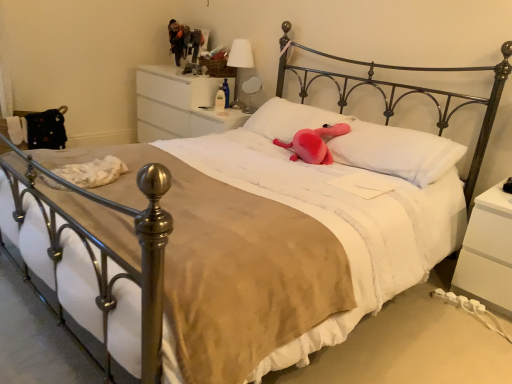
How much space does white soft pillow at center, placed as the 2th pillow when sorted from right to left, occupy horizontally?

white soft pillow at center, placed as the 2th pillow when sorted from right to left, is 14.45 inches in width.

The width and height of the screenshot is (512, 384). What are the coordinates of `white fabric-covered table lamp at upper center, acting as the 1th table lamp starting from the top` in the screenshot? It's located at (239, 65).

This screenshot has width=512, height=384. I want to click on pink plush toy at center, so click(x=314, y=143).

How different are the orientations of white glossy table lamp at upper center, which is counted as the first table lamp, starting from the bottom, and white fabric-covered table lamp at upper center, acting as the 1th table lamp starting from the top, in degrees?

→ The angular difference between white glossy table lamp at upper center, which is counted as the first table lamp, starting from the bottom, and white fabric-covered table lamp at upper center, acting as the 1th table lamp starting from the top, is 2.11 degrees.

In the scene shown: Measure the distance from white glossy table lamp at upper center, which appears as the second table lamp when viewed from the top, to white fabric-covered table lamp at upper center, the 2th table lamp when ordered from bottom to top.

white glossy table lamp at upper center, which appears as the second table lamp when viewed from the top, and white fabric-covered table lamp at upper center, the 2th table lamp when ordered from bottom to top, are 6.90 inches apart.

Is white glossy table lamp at upper center, which is counted as the first table lamp, starting from the bottom, not within white fabric-covered table lamp at upper center, the 2th table lamp when ordered from bottom to top?

Yes, white glossy table lamp at upper center, which is counted as the first table lamp, starting from the bottom, is located beyond the bounds of white fabric-covered table lamp at upper center, the 2th table lamp when ordered from bottom to top.

Considering the positions of objects white glossy table lamp at upper center, which appears as the second table lamp when viewed from the top, and white fabric-covered table lamp at upper center, the 2th table lamp when ordered from bottom to top, in the image provided, who is behind, white glossy table lamp at upper center, which appears as the second table lamp when viewed from the top, or white fabric-covered table lamp at upper center, the 2th table lamp when ordered from bottom to top,?

white glossy table lamp at upper center, which appears as the second table lamp when viewed from the top, is further away from the camera.

From the image's perspective, is white glossy table lamp at upper center, which appears as the second table lamp when viewed from the top, located above or below pink plush toy at center?

white glossy table lamp at upper center, which appears as the second table lamp when viewed from the top, is situated higher than pink plush toy at center in the image.

Can you tell me how much white glossy table lamp at upper center, which is counted as the first table lamp, starting from the bottom, and pink plush toy at center differ in facing direction?

Answer: The angle between the facing direction of white glossy table lamp at upper center, which is counted as the first table lamp, starting from the bottom, and the facing direction of pink plush toy at center is 7.15 degrees.

Is white glossy table lamp at upper center, which appears as the second table lamp when viewed from the top, oriented towards pink plush toy at center?

No, white glossy table lamp at upper center, which appears as the second table lamp when viewed from the top, is not facing towards pink plush toy at center.

From their relative heights in the image, would you say white glossy table lamp at upper center, which is counted as the first table lamp, starting from the bottom, is taller or shorter than pink plush toy at center?

Considering their sizes, white glossy table lamp at upper center, which is counted as the first table lamp, starting from the bottom, has more height than pink plush toy at center.

From the image's perspective, which is above, white soft pillow at center, placed as the 2th pillow when sorted from right to left, or white glossy nightstand at upper center, which ranks as the second nightstand in back-to-front order?

white glossy nightstand at upper center, which ranks as the second nightstand in back-to-front order, appears higher in the image.

Does white soft pillow at center, the 1th pillow viewed from the left, have a larger size compared to white glossy nightstand at upper center, the 2th nightstand from the bottom?

Yes.

From the picture: From a real-world perspective, is white soft pillow at center, placed as the 2th pillow when sorted from right to left, physically located above or below white glossy nightstand at upper center, the second nightstand from the top?

In terms of real-world spatial position, white soft pillow at center, placed as the 2th pillow when sorted from right to left, is above white glossy nightstand at upper center, the second nightstand from the top.

Is white soft pillow at center, the 1th pillow viewed from the left, next to white glossy nightstand at upper center, acting as the 2th nightstand starting from the left?

No, white soft pillow at center, the 1th pillow viewed from the left, is not with white glossy nightstand at upper center, acting as the 2th nightstand starting from the left.

From a real-world perspective, does pink plush toy at center stand above white glossy nightstand at upper center, acting as the 2th nightstand starting from the left?

Yes, from a real-world perspective, pink plush toy at center is above white glossy nightstand at upper center, acting as the 2th nightstand starting from the left.

Which is closer, (319,145) or (240,124)?

Positioned in front is point (319,145).

Is white glossy nightstand at upper center, the second nightstand from the top, a part of pink plush toy at center?

No, pink plush toy at center does not contain white glossy nightstand at upper center, the second nightstand from the top.

Between pink plush toy at center and white glossy nightstand at upper center, the 2th nightstand from the bottom, which one appears on the left side from the viewer's perspective?

From the viewer's perspective, white glossy nightstand at upper center, the 2th nightstand from the bottom, appears more on the left side.

From the image's perspective, is white fabric-covered table lamp at upper center, the 2th table lamp when ordered from bottom to top, located beneath white soft pillow at center, placed as the 2th pillow when sorted from right to left?

No.

Looking at their sizes, would you say white fabric-covered table lamp at upper center, acting as the 1th table lamp starting from the top, is wider or thinner than white soft pillow at center, the 1th pillow viewed from the left?

white fabric-covered table lamp at upper center, acting as the 1th table lamp starting from the top, is thinner than white soft pillow at center, the 1th pillow viewed from the left.

Is white fabric-covered table lamp at upper center, the 2th table lamp when ordered from bottom to top, smaller than white soft pillow at center, placed as the 2th pillow when sorted from right to left?

Yes.

Based on the photo, between white fabric-covered table lamp at upper center, acting as the 1th table lamp starting from the top, and white soft pillow at center, placed as the 2th pillow when sorted from right to left, which one has more height?

With more height is white fabric-covered table lamp at upper center, acting as the 1th table lamp starting from the top.

Which of these two, white soft pillow at center, the 1th pillow viewed from the left, or pink plush toy at center, is bigger?

Bigger between the two is white soft pillow at center, the 1th pillow viewed from the left.

Is point (251, 123) farther from viewer compared to point (345, 128)?

Yes, it is.

Looking at this image, is white soft pillow at center, the 1th pillow viewed from the left, next to pink plush toy at center and touching it?

No, white soft pillow at center, the 1th pillow viewed from the left, is not beside pink plush toy at center.

Can you confirm if white fluffy blanket at lower left is positioned to the right of white soft pillow at center, placed as the 2th pillow when sorted from right to left?

In fact, white fluffy blanket at lower left is to the left of white soft pillow at center, placed as the 2th pillow when sorted from right to left.

How many degrees apart are the facing directions of white fluffy blanket at lower left and white soft pillow at center, placed as the 2th pillow when sorted from right to left?

white fluffy blanket at lower left and white soft pillow at center, placed as the 2th pillow when sorted from right to left, are facing 10.3 degrees away from each other.

Would you say white fluffy blanket at lower left is outside white soft pillow at center, the 1th pillow viewed from the left?

white fluffy blanket at lower left is positioned outside white soft pillow at center, the 1th pillow viewed from the left.

From a real-world perspective, is white fluffy blanket at lower left physically above white soft pillow at center, placed as the 2th pillow when sorted from right to left?

Actually, white fluffy blanket at lower left is physically below white soft pillow at center, placed as the 2th pillow when sorted from right to left, in the real world.

Where is `table lamp below the white fabric-covered table lamp at upper center, the 2th table lamp when ordered from bottom to top (from the image's perspective)`? The height and width of the screenshot is (384, 512). table lamp below the white fabric-covered table lamp at upper center, the 2th table lamp when ordered from bottom to top (from the image's perspective) is located at coordinates (251, 91).

The image size is (512, 384). What are the coordinates of `the 1st table lamp counting from the left of the pink plush toy at center` in the screenshot? It's located at (251, 91).

When comparing their distances from white fabric-covered table lamp at upper center, acting as the 1th table lamp starting from the top, does white glossy table lamp at upper center, which appears as the second table lamp when viewed from the top, or white fluffy blanket at lower left seem closer?

Among the two, white glossy table lamp at upper center, which appears as the second table lamp when viewed from the top, is located nearer to white fabric-covered table lamp at upper center, acting as the 1th table lamp starting from the top.

Estimate the real-world distances between objects in this image. Which object is closer to white glossy drawer at upper center, which appears as the 1th nightstand when viewed from the top, pink plush at center, positioned as the second pillow in left-to-right order, or white fabric-covered table lamp at upper center, acting as the 1th table lamp starting from the top?

white fabric-covered table lamp at upper center, acting as the 1th table lamp starting from the top, lies closer to white glossy drawer at upper center, which appears as the 1th nightstand when viewed from the top, than the other object.

Estimate the real-world distances between objects in this image. Which object is further from white soft pillow at center, placed as the 2th pillow when sorted from right to left, white matte nightstand at lower right, positioned as the first nightstand in right-to-left order, or white fabric-covered table lamp at upper center, the 2th table lamp when ordered from bottom to top?

→ The object further to white soft pillow at center, placed as the 2th pillow when sorted from right to left, is white matte nightstand at lower right, positioned as the first nightstand in right-to-left order.

Considering their positions, is white matte nightstand at lower right, the 3th nightstand when ordered from top to bottom, positioned closer to white fluffy blanket at lower left than white glossy nightstand at upper center, the second nightstand from the top?

white glossy nightstand at upper center, the second nightstand from the top.

Considering their positions, is white glossy drawer at upper center, the third nightstand viewed from the right, positioned closer to white fabric-covered table lamp at upper center, the 2th table lamp when ordered from bottom to top, than pink plush toy at center?

Among the two, white glossy drawer at upper center, the third nightstand viewed from the right, is located nearer to white fabric-covered table lamp at upper center, the 2th table lamp when ordered from bottom to top.

Considering their positions, is pink plush at center, positioned as the second pillow in left-to-right order, positioned further to white glossy table lamp at upper center, which appears as the second table lamp when viewed from the top, than white glossy drawer at upper center, acting as the first nightstand starting from the back?

The object further to white glossy table lamp at upper center, which appears as the second table lamp when viewed from the top, is pink plush at center, positioned as the second pillow in left-to-right order.

Which object lies further to the anchor point white glossy drawer at upper center, the 1th nightstand positioned from the left, pink plush toy at center or white fluffy blanket at lower left?

white fluffy blanket at lower left.

Based on their spatial positions, is white glossy table lamp at upper center, which appears as the second table lamp when viewed from the top, or pink plush at center, the 1th pillow from the right, further from white fabric-covered table lamp at upper center, acting as the 1th table lamp starting from the top?

pink plush at center, the 1th pillow from the right, lies further to white fabric-covered table lamp at upper center, acting as the 1th table lamp starting from the top, than the other object.

Locate an element on the screen. Image resolution: width=512 pixels, height=384 pixels. nightstand between white soft pillow at center, placed as the 2th pillow when sorted from right to left, and white glossy drawer at upper center, which appears as the 1th nightstand when viewed from the top, in the front-back direction is located at coordinates (215, 121).

You are a GUI agent. You are given a task and a screenshot of the screen. Output one action in this format:
    pyautogui.click(x=<x>, y=<y>)
    Task: Click on the animal positioned between white fluffy blanket at lower left and white glossy nightstand at upper center, the 2th nightstand positioned from the right, from near to far
    
    Given the screenshot: What is the action you would take?
    pyautogui.click(x=314, y=143)

The image size is (512, 384). Identify the location of pillow located between pink plush toy at center and white fabric-covered table lamp at upper center, acting as the 1th table lamp starting from the top, in the depth direction. click(290, 119).

Identify the location of table lamp located between white soft pillow at center, placed as the 2th pillow when sorted from right to left, and white glossy table lamp at upper center, which appears as the second table lamp when viewed from the top, in the depth direction. (239, 65).